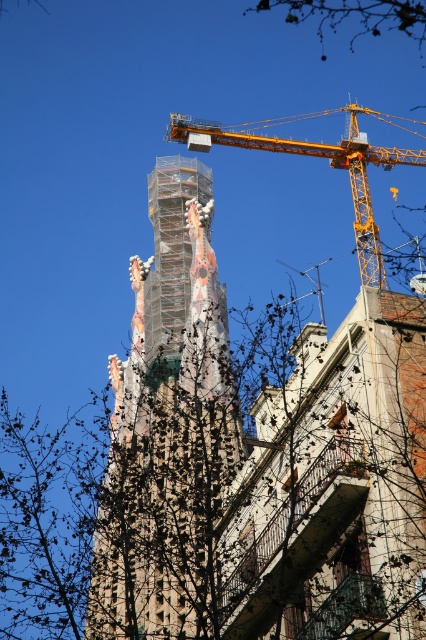
Can you confirm if multicolored mosaic tower at center is positioned below bare branches at upper center?

Correct, multicolored mosaic tower at center is located below bare branches at upper center.

Is multicolored mosaic tower at center further to camera compared to bare branches at upper center?

No, multicolored mosaic tower at center is in front of bare branches at upper center.

Is point (131, 589) positioned behind point (351, 42)?

No, it is not.

Find the location of a particular element. Image resolution: width=426 pixels, height=640 pixels. multicolored mosaic tower at center is located at coordinates (167, 429).

Is point (164, 538) more distant than point (184, 125)?

No, (164, 538) is in front of (184, 125).

Does multicolored mosaic tower at center have a smaller size compared to yellow metallic crane at upper center?

Yes.

Image resolution: width=426 pixels, height=640 pixels. In order to click on multicolored mosaic tower at center in this screenshot , I will do `click(167, 429)`.

Is yellow metallic crane at upper center shorter than bare branches at upper center?

No, yellow metallic crane at upper center is not shorter than bare branches at upper center.

Who is more forward, (385, 115) or (307, 4)?

Positioned in front is point (385, 115).

Who is more distant from viewer, (x=313, y=115) or (x=365, y=28)?

Positioned behind is point (x=365, y=28).

At what (x,y) coordinates should I click in order to perform the action: click on yellow metallic crane at upper center. Please return your answer as a coordinate pair (x, y). The height and width of the screenshot is (640, 426). Looking at the image, I should click on (x=321, y=156).